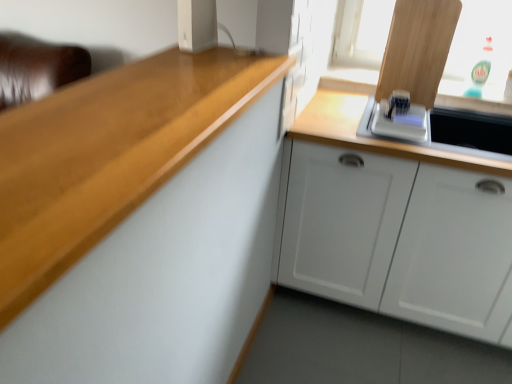
Where is `free space above wooden countertop at left, the second cabinetry in the right-to-left sequence (from a real-world perspective)`? The height and width of the screenshot is (384, 512). free space above wooden countertop at left, the second cabinetry in the right-to-left sequence (from a real-world perspective) is located at coordinates (134, 89).